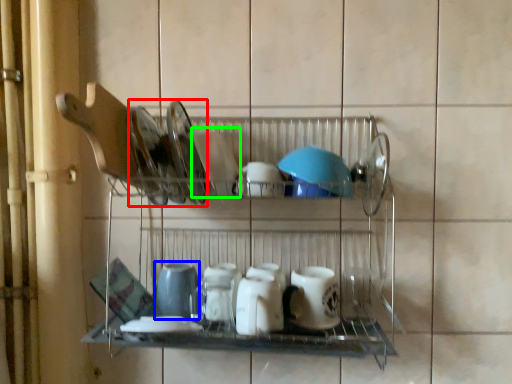
Question: Considering the real-world distances, which object is closest to tableware (highlighted by a red box)? appliance (highlighted by a blue box) or tableware (highlighted by a green box).

Choices:
 (A) appliance
 (B) tableware

Answer: (B)